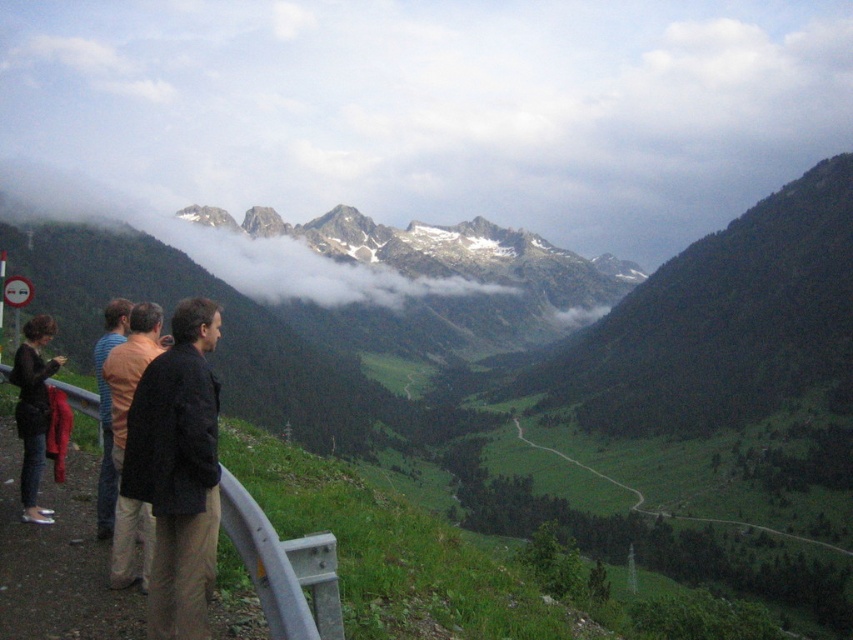
Who is more distant from viewer, [202,410] or [115,387]?

The point [115,387] is more distant.

Which is more to the left, black fabric jacket at center or black wool coat at left?

From the viewer's perspective, black wool coat at left appears more on the left side.

Where is `black fabric jacket at center`? Image resolution: width=853 pixels, height=640 pixels. black fabric jacket at center is located at coordinates (178, 470).

At what (x,y) coordinates should I click in order to perform the action: click on black fabric jacket at center. Please return your answer as a coordinate pair (x, y). This screenshot has width=853, height=640. Looking at the image, I should click on (178, 470).

Which is in front, point (177, 342) or point (103, 314)?

Positioned in front is point (177, 342).

How much distance is there between black fabric jacket at center and brown wool sweater at left?

A distance of 8.92 meters exists between black fabric jacket at center and brown wool sweater at left.

Image resolution: width=853 pixels, height=640 pixels. What do you see at coordinates (178, 470) in the screenshot?
I see `black fabric jacket at center` at bounding box center [178, 470].

The image size is (853, 640). Identify the location of black fabric jacket at center. (178, 470).

Who is positioned more to the left, black wool coat at left or dark blue jeans at left?

dark blue jeans at left is more to the left.

Based on the photo, who is more forward, [148,532] or [35,460]?

Point [148,532] is in front.

Between point (125, 506) and point (48, 417), which one is positioned in front?

Point (125, 506) is more forward.

You are a GUI agent. You are given a task and a screenshot of the screen. Output one action in this format:
    pyautogui.click(x=<x>, y=<y>)
    Task: Click on the black wool coat at left
    
    Given the screenshot: What is the action you would take?
    pyautogui.click(x=131, y=369)